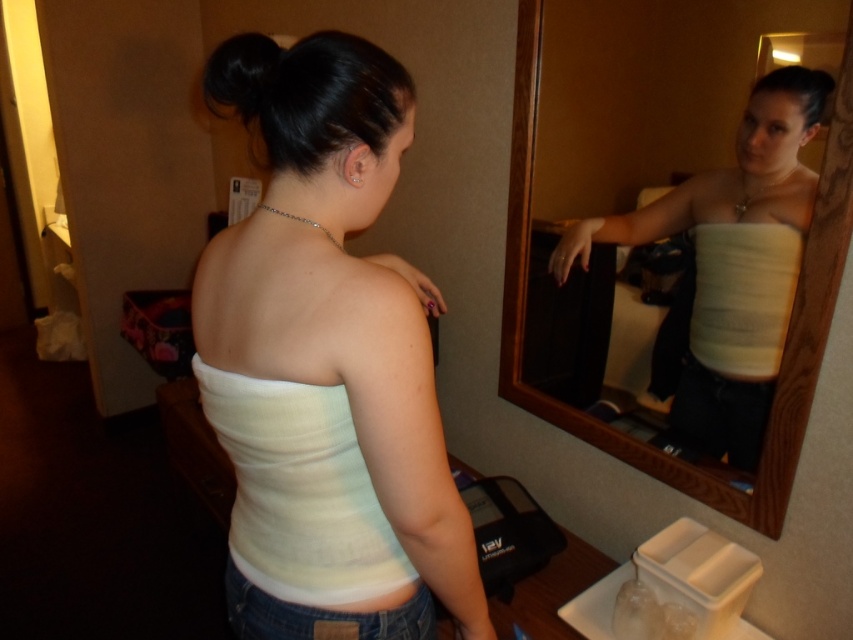
Question: Which object is positioned closest to the black shiny hair at upper center?

Choices:
 (A) white matte tank top at center
 (B) white fabric strapless top at upper center

Answer: (A)

Question: Which object appears closest to the camera in this image?

Choices:
 (A) white matte tank top at center
 (B) white fabric strapless top at upper center

Answer: (A)

Question: Can you confirm if white matte tank top at center is thinner than black shiny hair at upper center?

Choices:
 (A) no
 (B) yes

Answer: (B)

Question: Among these objects, which one is nearest to the camera?

Choices:
 (A) white fabric strapless top at upper center
 (B) white matte tank top at center
 (C) black shiny hair at upper center

Answer: (B)

Question: Does white matte tank top at center have a smaller size compared to white fabric strapless top at upper center?

Choices:
 (A) yes
 (B) no

Answer: (A)

Question: Does white matte tank top at center have a smaller size compared to black shiny hair at upper center?

Choices:
 (A) no
 (B) yes

Answer: (B)